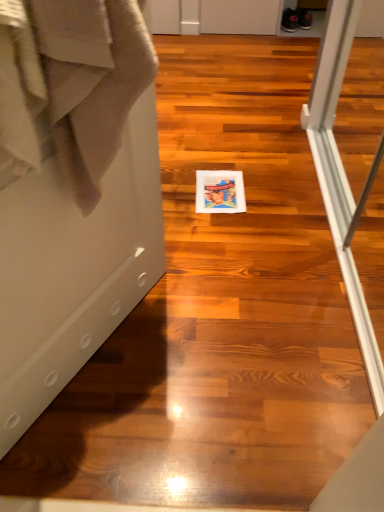
What are the coordinates of `free space in front of white glossy screen door at center` in the screenshot? It's located at (108, 440).